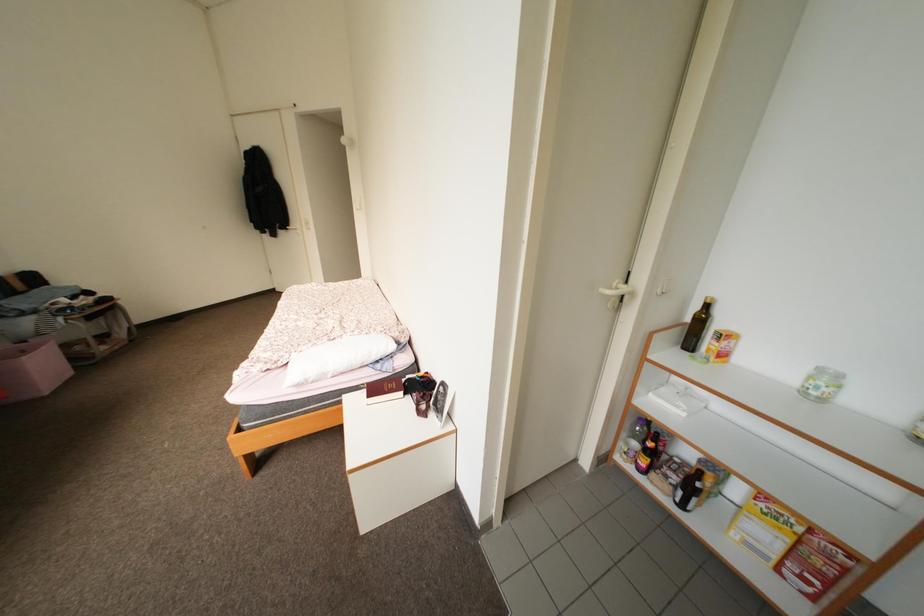
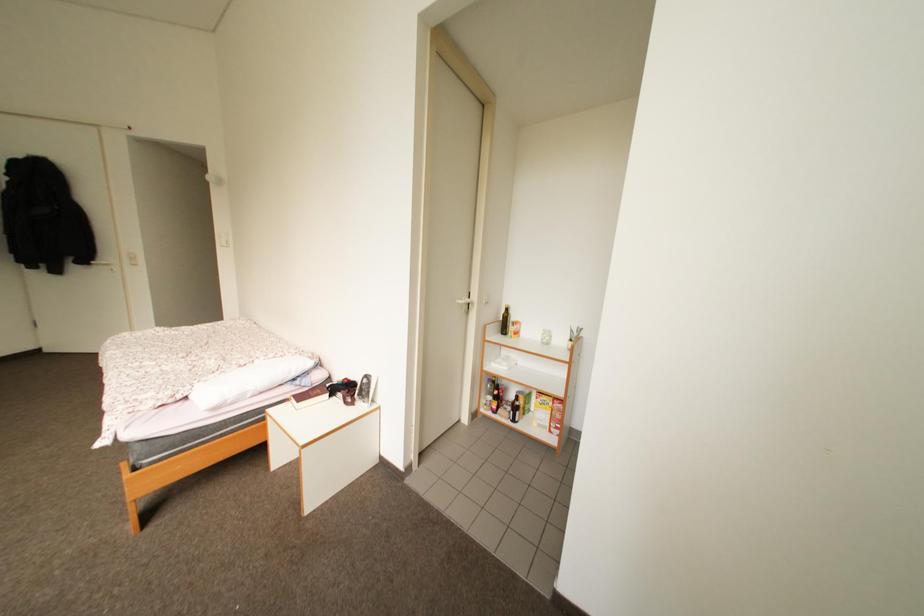
Question: The first image is from the beginning of the video and the second image is from the end. How did the camera likely rotate when shooting the video?

Choices:
 (A) Left
 (B) Right
 (C) Up
 (D) Down

Answer: (B)